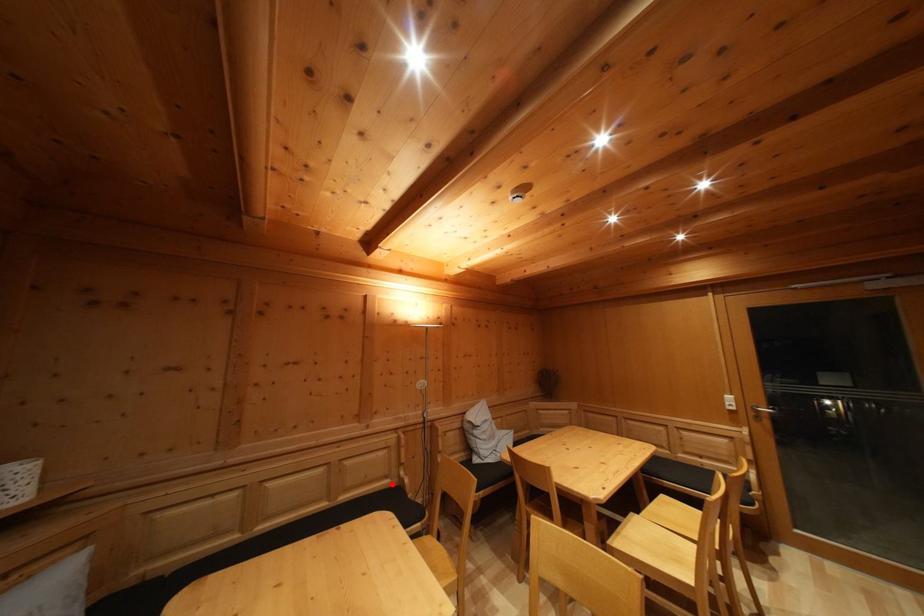
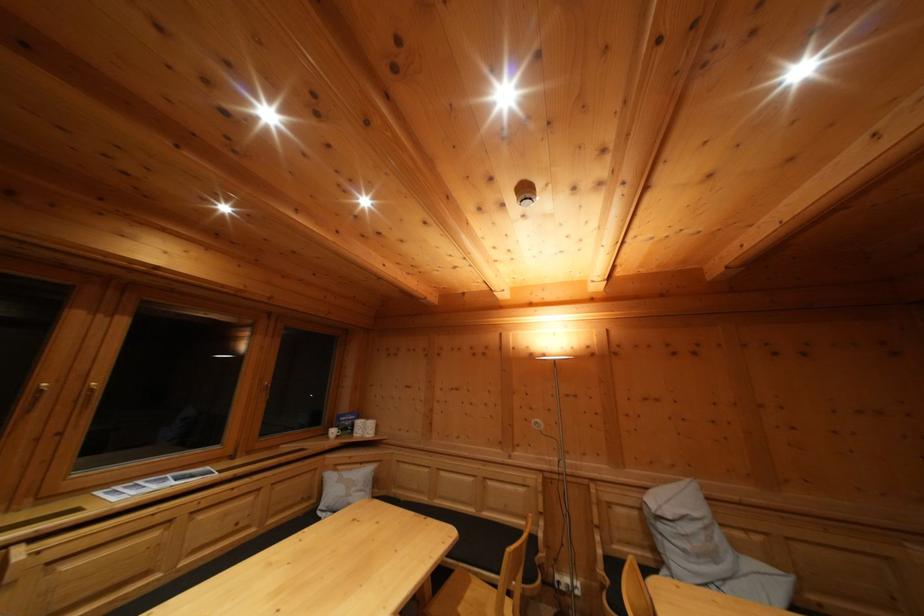
The point at the highlighted location is marked in the first image. Where is the corresponding point in the second image?

(532, 525)